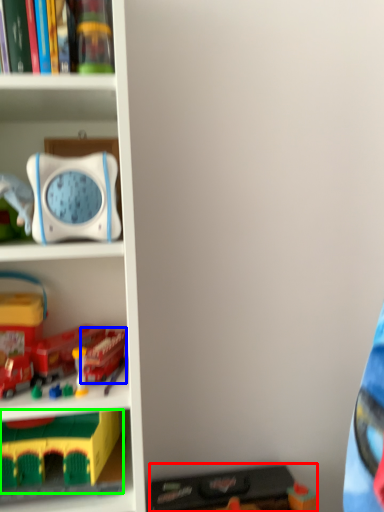
Question: Based on their relative distances, which object is farther from toy (highlighted by a red box)? Choose from toy (highlighted by a blue box) and toy (highlighted by a green box).

Choices:
 (A) toy
 (B) toy

Answer: (A)